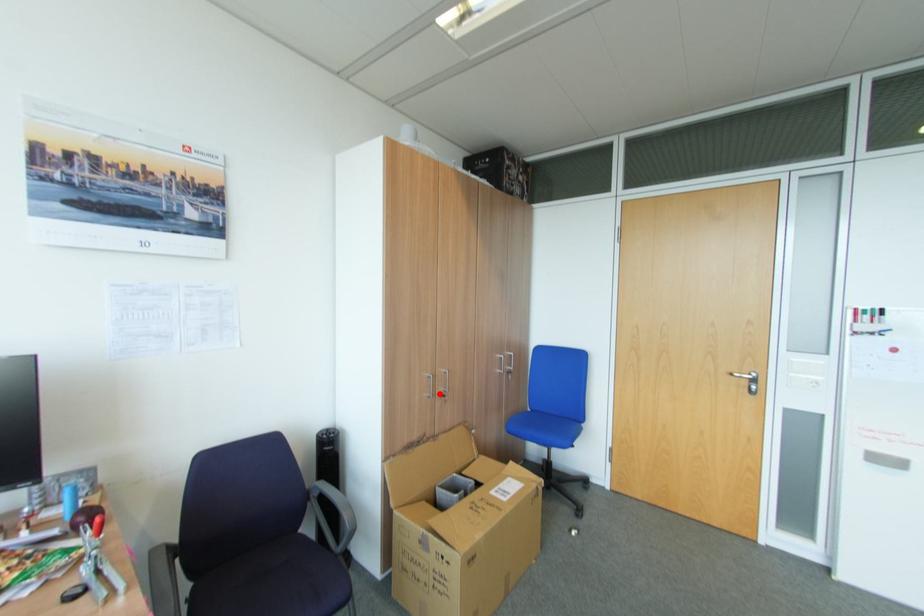
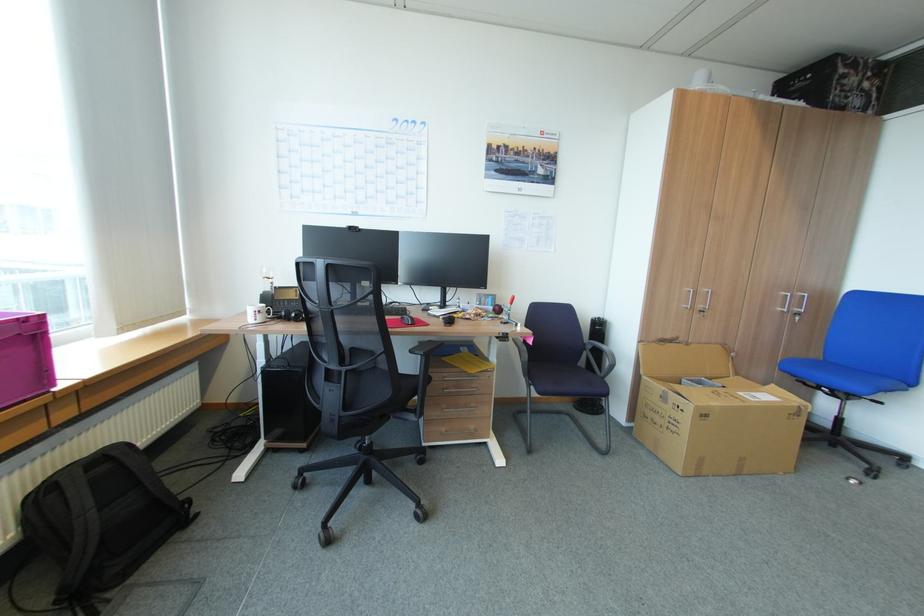
Question: I am providing you with two images of the same scene from different viewpoints. In image1, a red point is highlighted. Considering the same 3D point in image2, which of the following is correct?

Choices:
 (A) It is closer
 (B) It is farther

Answer: (A)